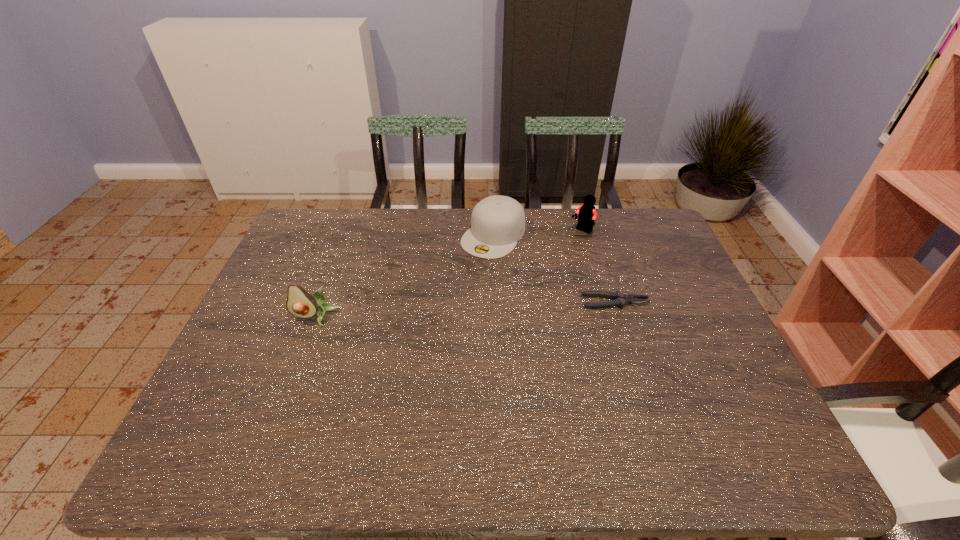
Locate an element on the screen. The width and height of the screenshot is (960, 540). blank space located on the front-facing side of the Lego is located at coordinates (553, 254).

The height and width of the screenshot is (540, 960). Find the location of `free space located 0.290m on the front-facing side of the Lego`. free space located 0.290m on the front-facing side of the Lego is located at coordinates (521, 280).

The height and width of the screenshot is (540, 960). What are the coordinates of `cap present at the far edge` in the screenshot? It's located at (497, 222).

Where is `Lego that is at the far edge`? This screenshot has width=960, height=540. Lego that is at the far edge is located at coordinates (587, 214).

The image size is (960, 540). Identify the location of object situated at the left edge. (300, 303).

This screenshot has height=540, width=960. What are the coordinates of `object situated at the right edge` in the screenshot? It's located at (620, 299).

This screenshot has height=540, width=960. What are the coordinates of `vacant area at the far edge of the desktop` in the screenshot? It's located at (457, 231).

Find the location of a particular element. Image resolution: width=960 pixels, height=540 pixels. vacant space at the near edge is located at coordinates (600, 417).

The width and height of the screenshot is (960, 540). Identify the location of vacant space at the left edge of the desktop. (244, 349).

You are a GUI agent. You are given a task and a screenshot of the screen. Output one action in this format:
    pyautogui.click(x=<x>, y=<y>)
    Task: Click on the free space at the right edge of the desktop
    The width and height of the screenshot is (960, 540).
    Given the screenshot: What is the action you would take?
    coord(682,272)